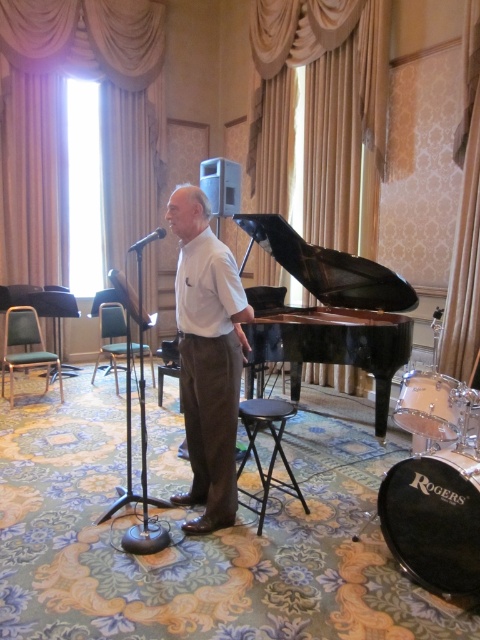
Question: Which object is farther from the camera taking this photo?

Choices:
 (A) clear glass drum at lower right
 (B) black drumhead at lower right

Answer: (A)

Question: Does black polished piano at center have a larger size compared to clear glass drum at lower right?

Choices:
 (A) yes
 (B) no

Answer: (A)

Question: Which of the following is the farthest from the observer?

Choices:
 (A) (431, 381)
 (B) (269, 289)
 (C) (286, 484)

Answer: (B)

Question: Is black polished piano at center to the right of black metallic microphone at center from the viewer's perspective?

Choices:
 (A) yes
 (B) no

Answer: (A)

Question: Based on their relative distances, which object is nearer to the white smooth shirt at center?

Choices:
 (A) clear glass drum at lower right
 (B) black drumhead at lower right
 (C) black plastic stool at center

Answer: (C)

Question: Can you confirm if clear glass drum at lower right is wider than black plastic stool at center?

Choices:
 (A) no
 (B) yes

Answer: (A)